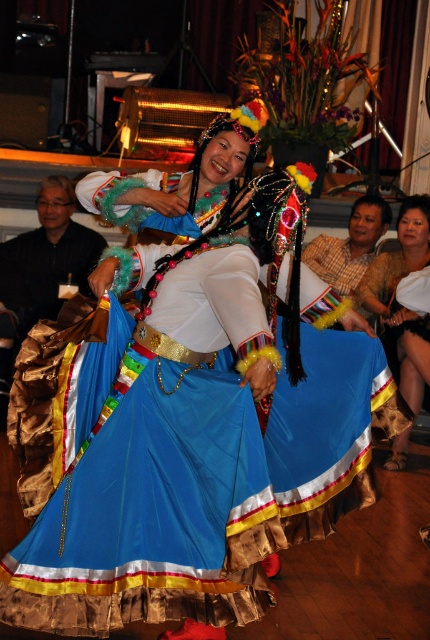
Question: Considering the relative positions of blue satin dress at center and silky brown dress at lower right in the image provided, where is blue satin dress at center located with respect to silky brown dress at lower right?

Choices:
 (A) below
 (B) above

Answer: (A)

Question: Estimate the real-world distances between objects in this image. Which object is farther from the plaid shirt at right?

Choices:
 (A) matte brown jacket at left
 (B) silky brown dress at lower right

Answer: (A)

Question: Can you confirm if blue satin dress at center is positioned to the right of plaid shirt at right?

Choices:
 (A) yes
 (B) no

Answer: (B)

Question: Which point is farther to the camera?

Choices:
 (A) (426, 262)
 (B) (381, 208)
 (C) (249, 602)

Answer: (B)

Question: Which point is farther to the camera?

Choices:
 (A) (49, 307)
 (B) (396, 227)

Answer: (B)

Question: Does silky brown dress at lower right appear under plaid shirt at right?

Choices:
 (A) no
 (B) yes

Answer: (B)